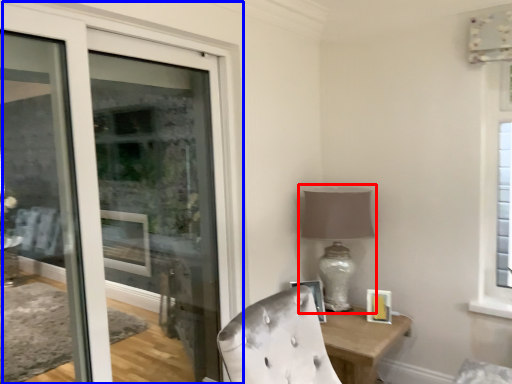
Question: Which object appears closest to the camera in this image, table lamp (highlighted by a red box) or door (highlighted by a blue box)?

Choices:
 (A) table lamp
 (B) door

Answer: (B)